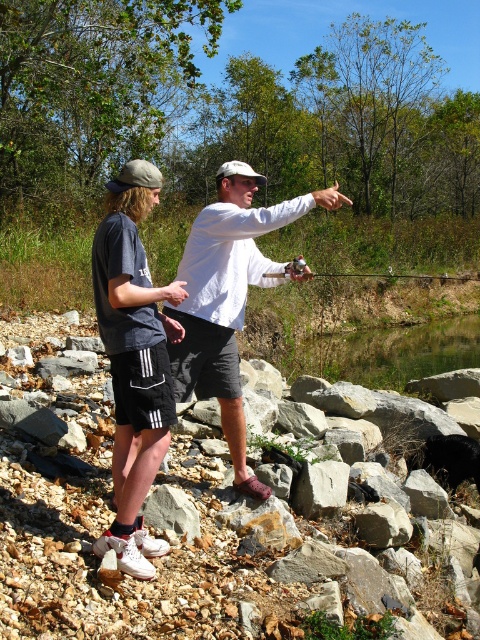
Is point (241, 253) less distant than point (376, 273)?

Yes.

Is white matte shirt at center below metallic silver fishing rod at center?

Indeed, white matte shirt at center is positioned under metallic silver fishing rod at center.

Is point (203, 392) farther from camera compared to point (307, 275)?

Yes.

The image size is (480, 640). I want to click on white matte shirt at center, so click(228, 296).

Who is more distant from viewer, [112,356] or [186,392]?

The point [186,392] is behind.

Is white matte shorts at center bigger than white matte shirt at center?

No.

Looking at this image, who is more forward, (145, 182) or (222, 320)?

Point (145, 182)

At what (x,y) coordinates should I click in order to perform the action: click on white matte shorts at center. Please return your answer as a coordinate pair (x, y). The height and width of the screenshot is (640, 480). Looking at the image, I should click on (133, 360).

Does point (112, 474) lie in front of point (345, 273)?

Yes, point (112, 474) is closer to viewer.

Locate an element on the screen. white matte shorts at center is located at coordinates 133,360.

Locate an element on the screen. This screenshot has height=640, width=480. white matte shorts at center is located at coordinates (133, 360).